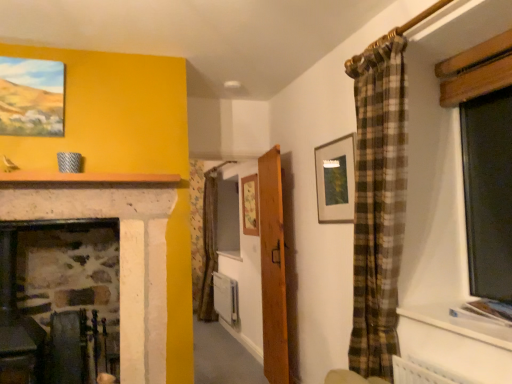
Question: From a real-world perspective, is matte gold picture frame at upper center, which ranks as the second picture frame in back-to-front order, physically located above or below wooden door at center?

Choices:
 (A) below
 (B) above

Answer: (B)

Question: Is point (322, 183) closer or farther from the camera than point (266, 374)?

Choices:
 (A) farther
 (B) closer

Answer: (B)

Question: Based on their relative distances, which object is farther from the white plastic radiator at center?

Choices:
 (A) matte gold picture frame at upper center, which is the first picture frame from right to left
 (B) wooden door at center
 (C) wooden picture frame at center, arranged as the 2th picture frame when viewed from the left
 (D) matte wooden picture frame at upper left, the third picture frame when ordered from back to front
 (E) white stone mantle at upper center

Answer: (D)

Question: Which is farther from the white stone mantle at upper center?

Choices:
 (A) white plastic radiator at center
 (B) wooden door at center
 (C) wooden picture frame at center, the 1th picture frame viewed from the back
 (D) matte gold picture frame at upper center, which ranks as the 2th picture frame in front-to-back order
 (E) matte wooden picture frame at upper left, marked as the 1th picture frame in a left-to-right arrangement

Answer: (A)